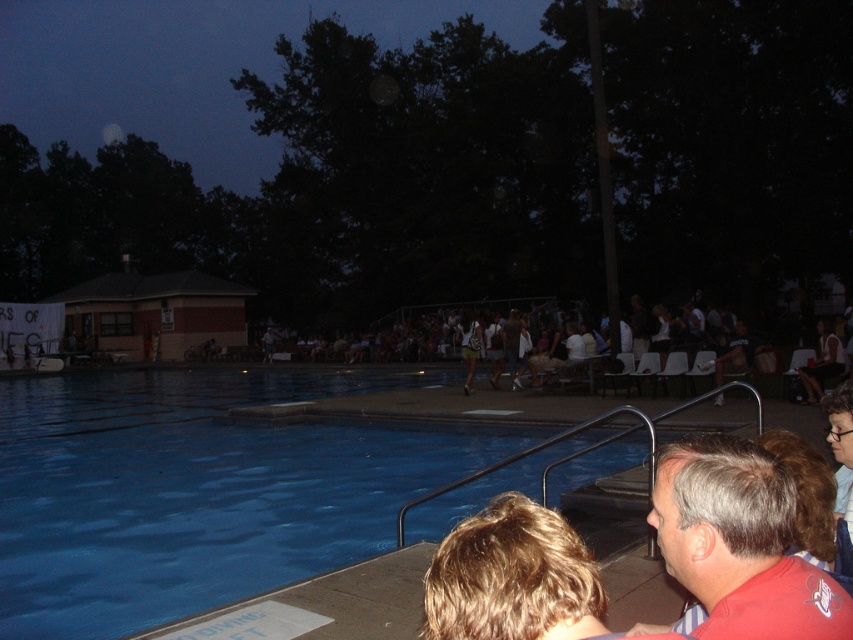
Question: Which of these objects is positioned farthest from the red matte shirt at lower right?

Choices:
 (A) blue smooth water at lower left
 (B) dark blue pool at center

Answer: (B)

Question: Estimate the real-world distances between objects in this image. Which object is farther from the dark blue pool at center?

Choices:
 (A) blue smooth water at lower left
 (B) red matte shirt at lower right

Answer: (B)

Question: Does dark blue pool at center appear under blue smooth water at lower left?

Choices:
 (A) no
 (B) yes

Answer: (A)

Question: Observing the image, what is the correct spatial positioning of dark blue pool at center in reference to blue smooth water at lower left?

Choices:
 (A) right
 (B) left

Answer: (B)

Question: Does dark blue pool at center lie in front of blue smooth water at lower left?

Choices:
 (A) no
 (B) yes

Answer: (A)

Question: Considering the real-world distances, which object is closest to the red matte shirt at lower right?

Choices:
 (A) dark blue pool at center
 (B) blue smooth water at lower left

Answer: (B)